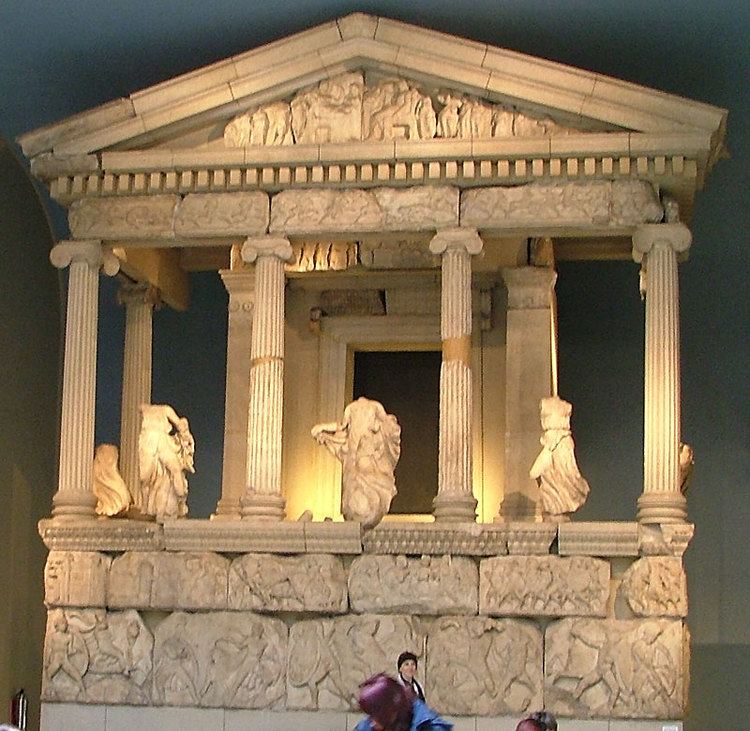
Identify the location of left of doorway. The height and width of the screenshot is (731, 750). (356, 352), (352, 398).